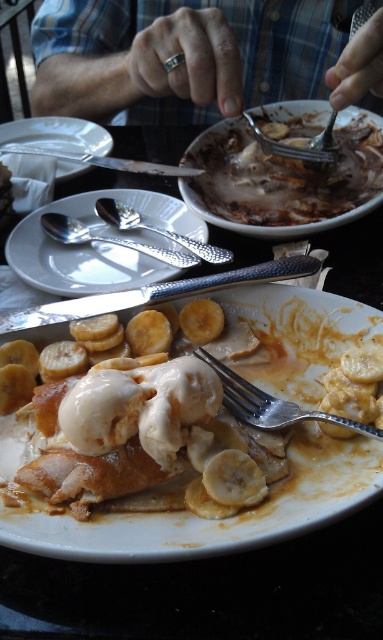
Which is in front, point (252, 182) or point (199, 262)?

Point (199, 262)

The width and height of the screenshot is (383, 640). What do you see at coordinates (284, 179) in the screenshot? I see `white porcelain plate at center` at bounding box center [284, 179].

The image size is (383, 640). Identify the location of white porcelain plate at center. (284, 179).

Is silver metallic ring at upper center thinner than satin silver fork at upper center?

In fact, silver metallic ring at upper center might be wider than satin silver fork at upper center.

Is point (122, 97) positioned behind point (350, 33)?

Yes, it is.

Between point (232, 10) and point (356, 8), which one is positioned behind?

Positioned behind is point (232, 10).

Where is `silver metallic ring at upper center`? This screenshot has height=640, width=383. silver metallic ring at upper center is located at coordinates (198, 56).

Is silver metallic fork at center thinner than brushed metal knife at upper center?

Indeed, silver metallic fork at center has a lesser width compared to brushed metal knife at upper center.

Can you confirm if silver metallic fork at center is smaller than brushed metal knife at upper center?

Yes.

The image size is (383, 640). Find the location of `silver metallic fork at center`. silver metallic fork at center is located at coordinates (271, 404).

Locate an element on the screen. The width and height of the screenshot is (383, 640). silver metallic fork at center is located at coordinates (271, 404).